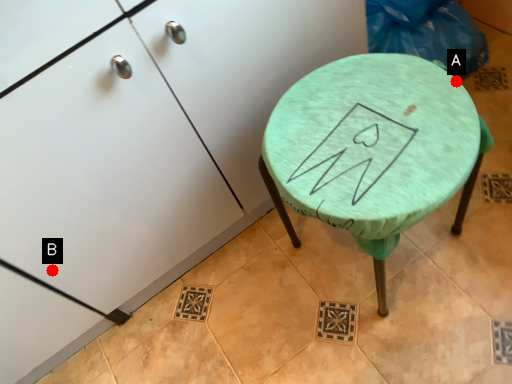
Question: Two points are circled on the image, labeled by A and B beside each circle. Among these points, which one is nearest to the camera?

Choices:
 (A) A is closer
 (B) B is closer

Answer: (A)